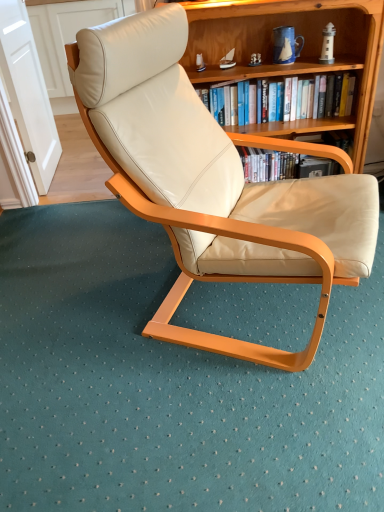
Locate an element on the screen. This screenshot has height=512, width=384. free space underneath matte cream leather chair at center (from a real-world perspective) is located at coordinates (257, 310).